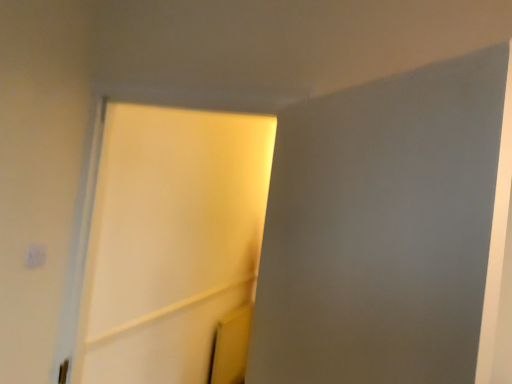
What do you see at coordinates (35, 256) in the screenshot?
I see `white matte light switch at upper left` at bounding box center [35, 256].

The width and height of the screenshot is (512, 384). Find the location of `white matte screen door at center, marked as the 2th screen door in a right-to-left arrangement`. white matte screen door at center, marked as the 2th screen door in a right-to-left arrangement is located at coordinates (170, 240).

Locate an element on the screen. This screenshot has width=512, height=384. white matte screen door at upper center, positioned as the 2th screen door in back-to-front order is located at coordinates (387, 230).

Is white matte screen door at upper center, positioned as the 2th screen door in back-to-front order, inside the boundaries of white matte light switch at upper left, or outside?

The correct answer is: outside.

Does white matte screen door at upper center, the 2th screen door positioned from the left, have a lesser height compared to white matte light switch at upper left?

No, white matte screen door at upper center, the 2th screen door positioned from the left, is not shorter than white matte light switch at upper left.

From a real-world perspective, is white matte screen door at upper center, the 2th screen door positioned from the left, positioned over white matte light switch at upper left based on gravity?

Yes, from a real-world perspective, white matte screen door at upper center, the 2th screen door positioned from the left, is above white matte light switch at upper left.

Measure the distance from white matte screen door at upper center, placed as the first screen door when sorted from right to left, to white matte screen door at center, which is the first screen door in back-to-front order.

They are 4.36 feet apart.

Who is taller, white matte screen door at upper center, the first screen door when ordered from front to back, or white matte screen door at center, marked as the 2th screen door in a right-to-left arrangement?

white matte screen door at center, marked as the 2th screen door in a right-to-left arrangement, is taller.

Is the depth of white matte screen door at upper center, positioned as the 2th screen door in back-to-front order, less than that of white matte screen door at center, which is the first screen door in left-to-right order?

Yes, it is.

Is white matte screen door at upper center, placed as the first screen door when sorted from right to left, to the left of white matte screen door at center, marked as the 2th screen door in a right-to-left arrangement, from the viewer's perspective?

No, white matte screen door at upper center, placed as the first screen door when sorted from right to left, is not to the left of white matte screen door at center, marked as the 2th screen door in a right-to-left arrangement.

Which is more to the right, white matte light switch at upper left or white matte screen door at center, which is the first screen door in left-to-right order?

white matte screen door at center, which is the first screen door in left-to-right order, is more to the right.

How different are the orientations of white matte light switch at upper left and white matte screen door at center, which is the first screen door in left-to-right order, in degrees?

white matte light switch at upper left and white matte screen door at center, which is the first screen door in left-to-right order, are facing 88.6 degrees away from each other.

Based on the photo, can you confirm if white matte light switch at upper left is thinner than white matte screen door at center, which is the first screen door in back-to-front order?

Correct, the width of white matte light switch at upper left is less than that of white matte screen door at center, which is the first screen door in back-to-front order.

Which is in front, point (148, 124) or point (37, 254)?

The point (37, 254) is closer to the camera.

Which object is thinner, white matte screen door at center, the 2th screen door viewed from the front, or white matte light switch at upper left?

Thinner between the two is white matte light switch at upper left.

Is white matte screen door at center, the 2th screen door viewed from the front, positioned with its back to white matte light switch at upper left?

No, white matte screen door at center, the 2th screen door viewed from the front,'s orientation is not away from white matte light switch at upper left.

Considering the sizes of objects white matte screen door at center, the 2th screen door viewed from the front, and white matte light switch at upper left in the image provided, who is smaller, white matte screen door at center, the 2th screen door viewed from the front, or white matte light switch at upper left?

white matte light switch at upper left is smaller.

From the image's perspective, between white matte light switch at upper left and white matte screen door at upper center, placed as the first screen door when sorted from right to left, which one is located above?

From the image's view, white matte screen door at upper center, placed as the first screen door when sorted from right to left, is above.

Do you think white matte light switch at upper left is within white matte screen door at upper center, placed as the first screen door when sorted from right to left, or outside of it?

white matte light switch at upper left is not inside white matte screen door at upper center, placed as the first screen door when sorted from right to left, it's outside.

Does white matte light switch at upper left have a greater height compared to white matte screen door at upper center, the first screen door when ordered from front to back?

Incorrect, the height of white matte light switch at upper left is not larger of that of white matte screen door at upper center, the first screen door when ordered from front to back.

How different are the orientations of white matte light switch at upper left and white matte screen door at upper center, positioned as the 2th screen door in back-to-front order, in degrees?

white matte light switch at upper left and white matte screen door at upper center, positioned as the 2th screen door in back-to-front order, are facing 133 degrees away from each other.

Where is `screen door positioned vertically above the white matte screen door at center, the 2th screen door viewed from the front (from a real-world perspective)`? Image resolution: width=512 pixels, height=384 pixels. screen door positioned vertically above the white matte screen door at center, the 2th screen door viewed from the front (from a real-world perspective) is located at coordinates click(387, 230).

Which point is more distant from viewer, [170,363] or [479,272]?

The point [170,363] is farther.

Would you say white matte screen door at center, which is the first screen door in left-to-right order, is to the left or to the right of white matte screen door at upper center, positioned as the 2th screen door in back-to-front order, in the picture?

In the image, white matte screen door at center, which is the first screen door in left-to-right order, appears on the left side of white matte screen door at upper center, positioned as the 2th screen door in back-to-front order.

Can you confirm if white matte screen door at center, which is the first screen door in left-to-right order, is wider than white matte screen door at upper center, the 2th screen door positioned from the left?

Indeed, white matte screen door at center, which is the first screen door in left-to-right order, has a greater width compared to white matte screen door at upper center, the 2th screen door positioned from the left.

Where is `the 2nd screen door above when counting from the white matte light switch at upper left (from the image's perspective)`? the 2nd screen door above when counting from the white matte light switch at upper left (from the image's perspective) is located at coordinates (387, 230).

Locate an element on the screen. screen door below the white matte screen door at upper center, positioned as the 2th screen door in back-to-front order (from the image's perspective) is located at coordinates (170, 240).

When comparing their distances from white matte screen door at center, the 2th screen door viewed from the front, does white matte screen door at upper center, the 2th screen door positioned from the left, or white matte light switch at upper left seem further?

white matte light switch at upper left.

Looking at the image, which one is located closer to white matte screen door at upper center, placed as the first screen door when sorted from right to left, white matte light switch at upper left or white matte screen door at center, the 2th screen door viewed from the front?

Among the two, white matte light switch at upper left is located nearer to white matte screen door at upper center, placed as the first screen door when sorted from right to left.

When comparing their distances from white matte screen door at upper center, placed as the first screen door when sorted from right to left, does white matte screen door at center, which is the first screen door in left-to-right order, or white matte light switch at upper left seem further?

white matte screen door at center, which is the first screen door in left-to-right order, lies further to white matte screen door at upper center, placed as the first screen door when sorted from right to left, than the other object.

From the image, which object appears to be farther from white matte light switch at upper left, white matte screen door at center, marked as the 2th screen door in a right-to-left arrangement, or white matte screen door at upper center, positioned as the 2th screen door in back-to-front order?

The object further to white matte light switch at upper left is white matte screen door at center, marked as the 2th screen door in a right-to-left arrangement.

Based on their spatial positions, is white matte light switch at upper left or white matte screen door at upper center, positioned as the 2th screen door in back-to-front order, closer to white matte screen door at center, the 2th screen door viewed from the front?

white matte screen door at upper center, positioned as the 2th screen door in back-to-front order, is closer to white matte screen door at center, the 2th screen door viewed from the front.

Considering their positions, is white matte screen door at upper center, the 2th screen door positioned from the left, positioned further to white matte light switch at upper left than white matte screen door at center, which is the first screen door in left-to-right order?

white matte screen door at center, which is the first screen door in left-to-right order, lies further to white matte light switch at upper left than the other object.

Locate an element on the screen. This screenshot has width=512, height=384. screen door between white matte light switch at upper left and white matte screen door at upper center, the 2th screen door positioned from the left is located at coordinates (170, 240).